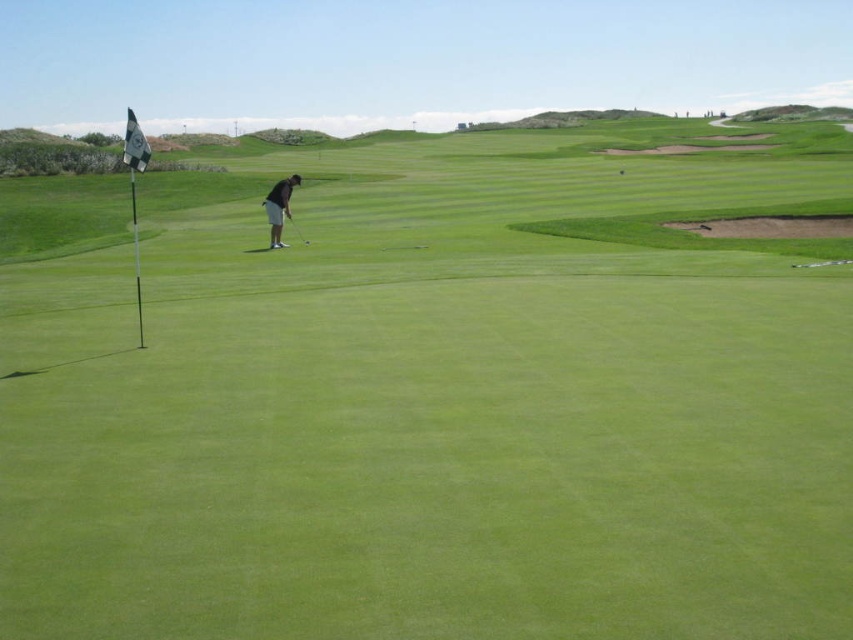
You are a golf instructor analyzing a student golfer in the scene. The student is wearing dark gray pants at center and holding a metallic silver golf club at center. Based on the height comparison between these two items, which one is more likely to be visible to someone standing behind the golfer?

→ The dark gray pants at center is taller than the metallic silver golf club at center, so the dark gray pants at center would be more visible to someone standing behind the golfer since it has a greater height.

You are a golfer trying to hit a ball towards the flagstick. You notice the dark gray pants at center and the metallic silver golf club at center in your line of sight. Which object is closer to you, the golfer?

The dark gray pants at center is closer to you because it is in front of the metallic silver golf club at center in your line of sight.